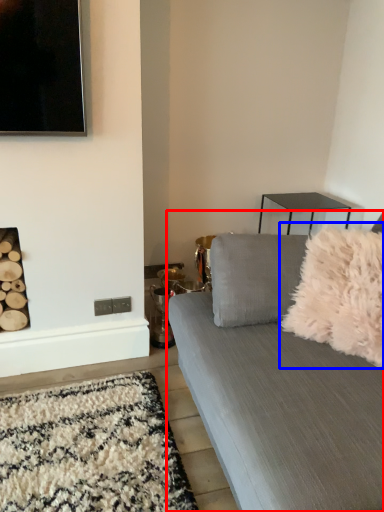
Question: Among these objects, which one is nearest to the camera, studio couch (highlighted by a red box) or throw pillow (highlighted by a blue box)?

Choices:
 (A) studio couch
 (B) throw pillow

Answer: (A)